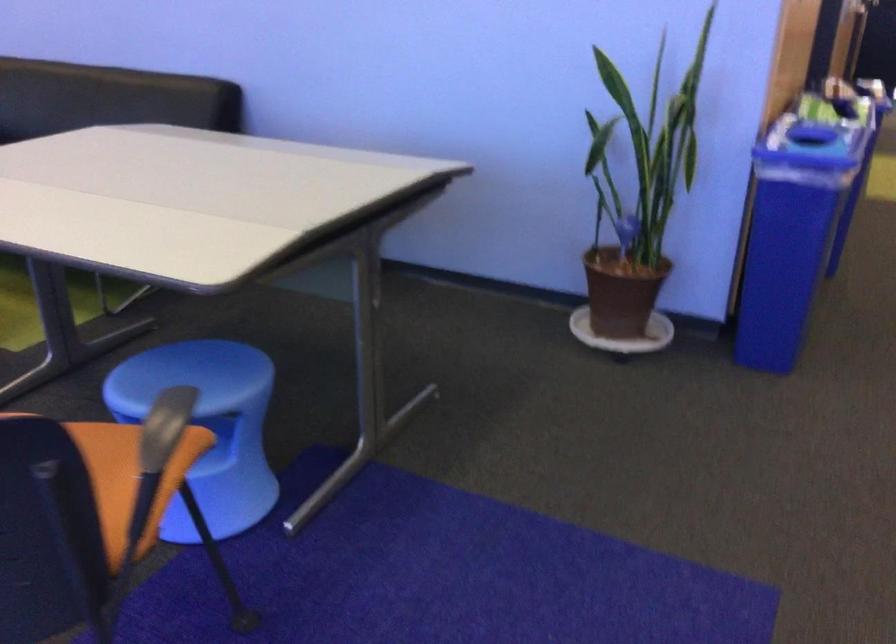
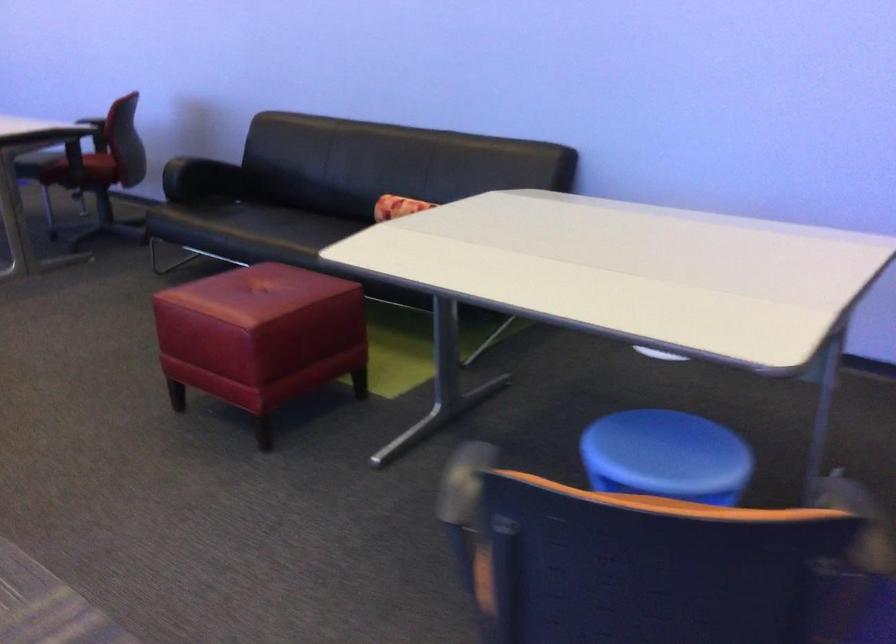
Question: Based on the continuous images, in which direction is the camera rotating? Reply with the corresponding letter.

Choices:
 (A) Left
 (B) Right
 (C) Up
 (D) Down

Answer: (A)